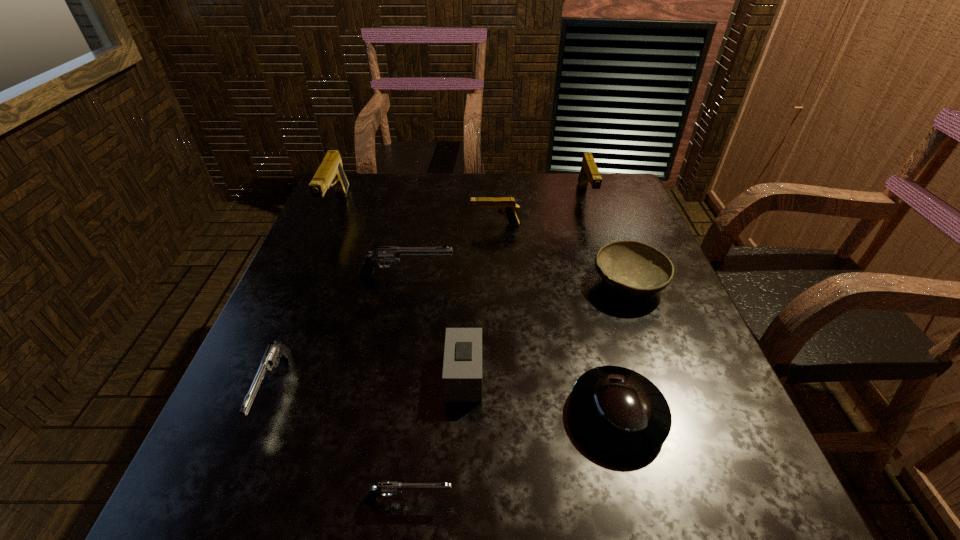
Locate an element on the screen. saucer situated at the right edge is located at coordinates (622, 411).

Identify the location of object that is at the far left corner. The image size is (960, 540). (330, 173).

The image size is (960, 540). I want to click on object positioned at the far right corner, so tap(589, 173).

This screenshot has width=960, height=540. Find the location of `object at the near right corner`. object at the near right corner is located at coordinates (622, 411).

The width and height of the screenshot is (960, 540). In the image, there is a desktop. Find the location of `vacant space at the far edge`. vacant space at the far edge is located at coordinates (399, 182).

The image size is (960, 540). Identify the location of free space at the near edge of the desktop. (617, 464).

In the image, there is a desktop. Identify the location of vacant space at the left edge. This screenshot has height=540, width=960. (347, 273).

The height and width of the screenshot is (540, 960). I want to click on vacant area at the right edge, so click(x=642, y=299).

Locate an element on the screen. This screenshot has height=540, width=960. vacant region at the far left corner is located at coordinates (325, 204).

In the image, there is a desktop. Where is `free space at the far right corner`? The height and width of the screenshot is (540, 960). free space at the far right corner is located at coordinates (608, 196).